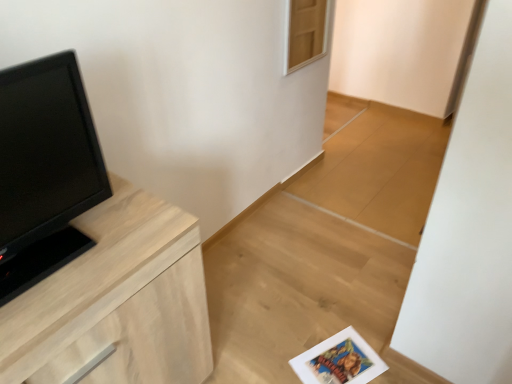
Question: From the image's perspective, would you say light wood chest of drawers at left is shown under black matte tv at left?

Choices:
 (A) yes
 (B) no

Answer: (A)

Question: Does light wood chest of drawers at left have a larger size compared to black matte tv at left?

Choices:
 (A) no
 (B) yes

Answer: (B)

Question: Is light wood chest of drawers at left wider than black matte tv at left?

Choices:
 (A) yes
 (B) no

Answer: (A)

Question: Is black matte tv at left completely or partially inside light wood chest of drawers at left?

Choices:
 (A) yes
 (B) no

Answer: (B)

Question: Does light wood chest of drawers at left have a lesser width compared to black matte tv at left?

Choices:
 (A) no
 (B) yes

Answer: (A)

Question: Is light wood chest of drawers at left outside black matte tv at left?

Choices:
 (A) no
 (B) yes

Answer: (B)

Question: Does black matte tv at left appear on the right side of light wood chest of drawers at left?

Choices:
 (A) no
 (B) yes

Answer: (A)

Question: Are black matte tv at left and light wood chest of drawers at left far apart?

Choices:
 (A) no
 (B) yes

Answer: (A)

Question: Would you say black matte tv at left is outside light wood chest of drawers at left?

Choices:
 (A) no
 (B) yes

Answer: (B)

Question: From a real-world perspective, is black matte tv at left positioned under light wood chest of drawers at left based on gravity?

Choices:
 (A) no
 (B) yes

Answer: (A)

Question: Is black matte tv at left placed right next to light wood chest of drawers at left?

Choices:
 (A) yes
 (B) no

Answer: (B)

Question: Considering the relative sizes of black matte tv at left and light wood chest of drawers at left in the image provided, is black matte tv at left bigger than light wood chest of drawers at left?

Choices:
 (A) no
 (B) yes

Answer: (A)

Question: Considering the positions of light wood chest of drawers at left and black matte tv at left in the image, is light wood chest of drawers at left wider or thinner than black matte tv at left?

Choices:
 (A) thin
 (B) wide

Answer: (B)